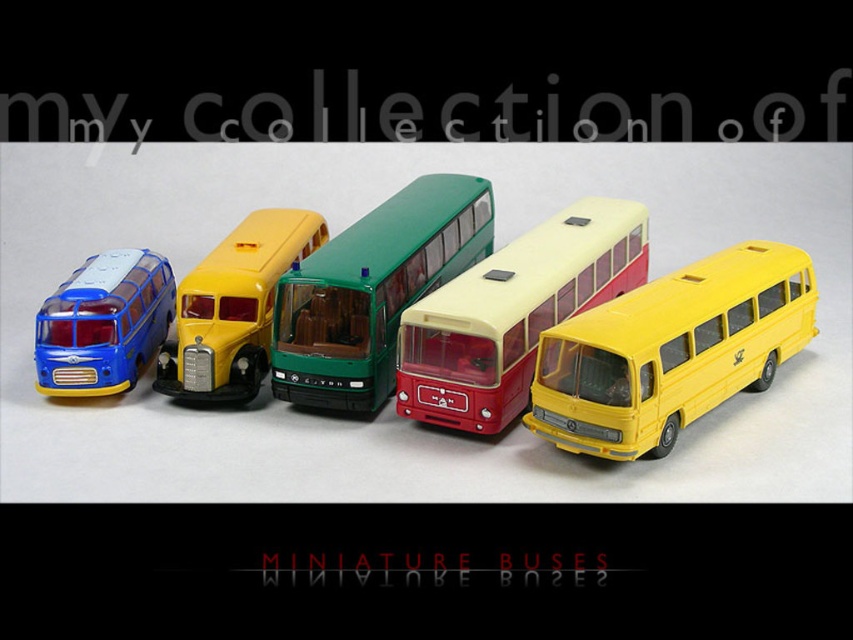
You are standing 5 feet away from the yellow matte bus at right. Can you see the camera clearly?

The yellow matte bus at right and camera are 4.28 feet apart, so if you are standing 5 feet away from the yellow matte bus at right, you are 9.28 feet away from the camera. Whether you can see the camera clearly depends on your vision and the camera size, but the distance is about 9.28 feet.